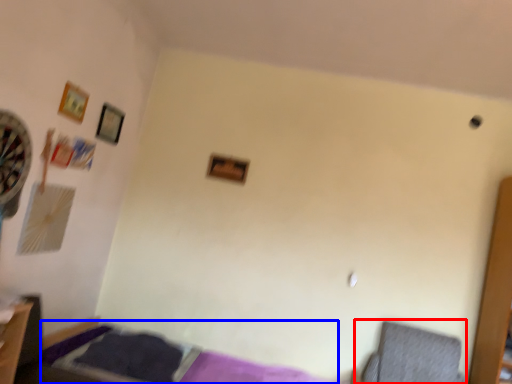
Question: Which point is closer to the camera, swivel chair (highlighted by a red box) or bed (highlighted by a blue box)?

Choices:
 (A) swivel chair
 (B) bed

Answer: (B)